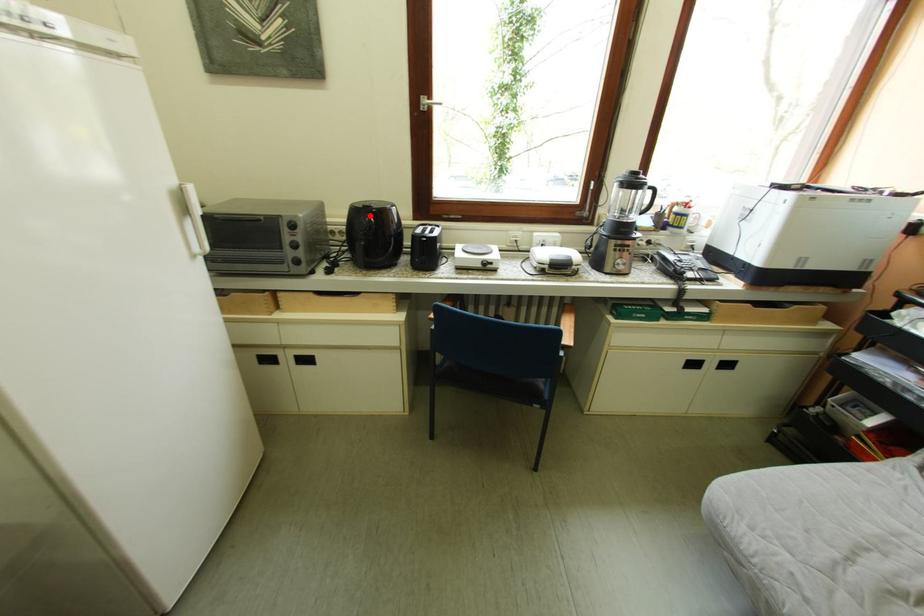
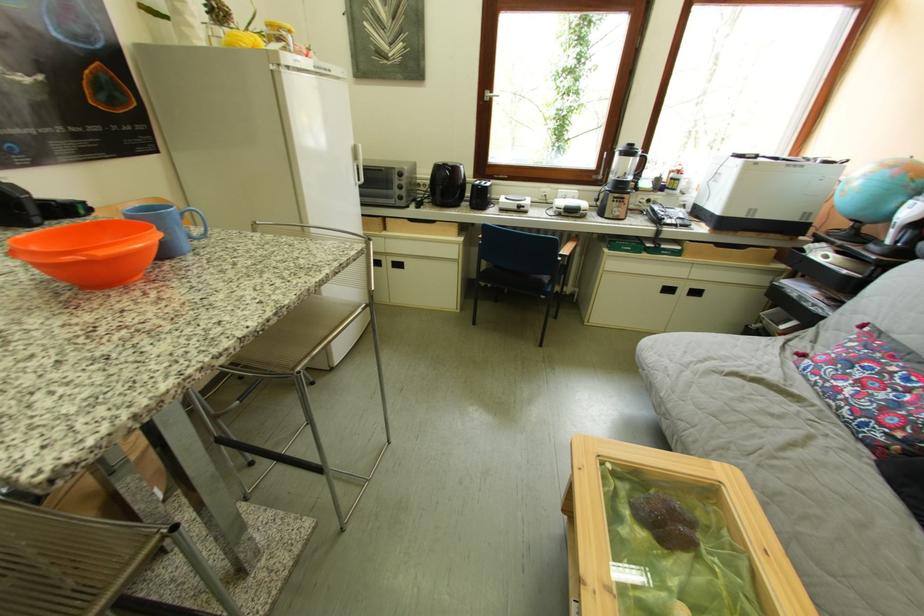
Find the pixel in the second image that matches the highlighted location in the first image.

(451, 171)